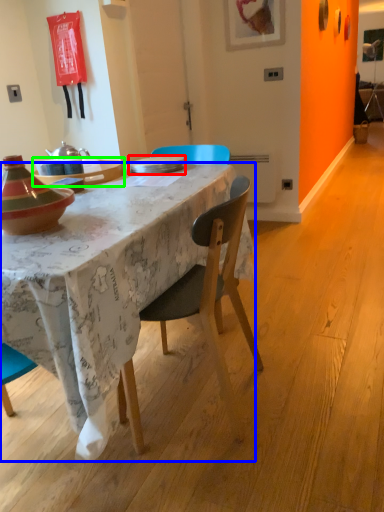
Question: Based on their relative distances, which object is nearer to plate (highlighted by a red box)? Choose from desk (highlighted by a blue box) and table (highlighted by a green box).

Choices:
 (A) desk
 (B) table

Answer: (B)